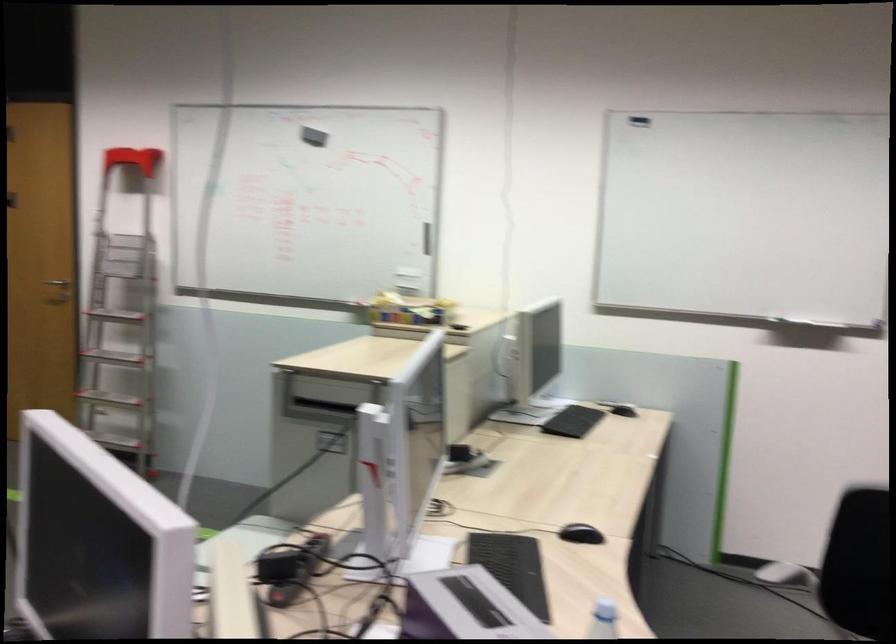
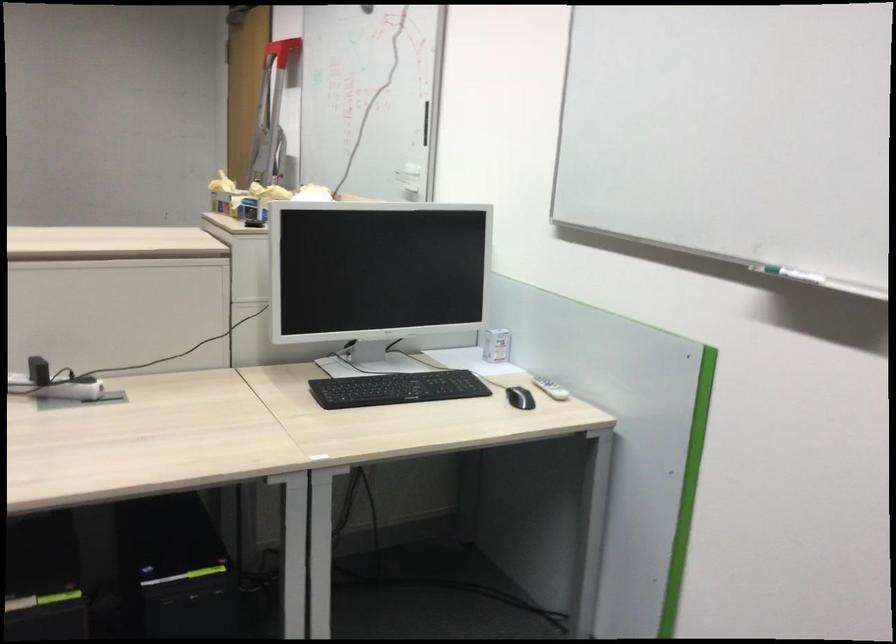
Question: I am providing you with two images of the same scene from different viewpoints. After the viewpoint changes to image2, which objects are now occluded?

Choices:
 (A) small white box
 (B) white power adapter
 (C) whiteboard handle
 (D) none of these

Answer: (D)